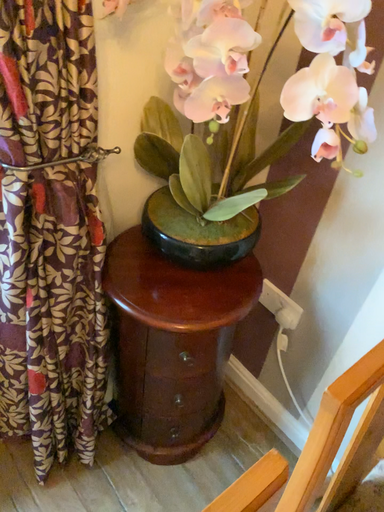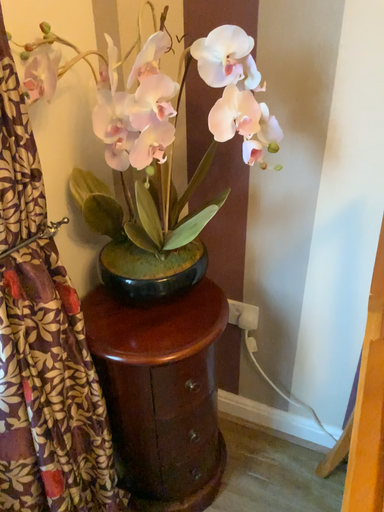
Question: Which way did the camera rotate in the video?

Choices:
 (A) rotated left
 (B) rotated right

Answer: (B)